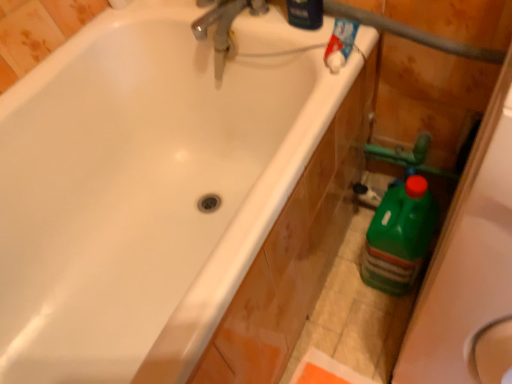
Question: Is green plastic bottle at right, which is counted as the first cleaning product, starting from the bottom, to the right of metallic chrome faucet at upper center from the viewer's perspective?

Choices:
 (A) yes
 (B) no

Answer: (A)

Question: Are green plastic bottle at right, which is counted as the first cleaning product, starting from the bottom, and metallic chrome faucet at upper center located far from each other?

Choices:
 (A) yes
 (B) no

Answer: (B)

Question: Is green plastic bottle at right, the 2th cleaning product viewed from the top, oriented towards metallic chrome faucet at upper center?

Choices:
 (A) no
 (B) yes

Answer: (A)

Question: From a real-world perspective, is green plastic bottle at right, which ranks as the 1th cleaning product in right-to-left order, positioned under metallic chrome faucet at upper center based on gravity?

Choices:
 (A) yes
 (B) no

Answer: (A)

Question: Is green plastic bottle at right, which ranks as the 1th cleaning product in right-to-left order, facing away from metallic chrome faucet at upper center?

Choices:
 (A) yes
 (B) no

Answer: (B)

Question: Can you confirm if green plastic bottle at right, the 2th cleaning product positioned from the front, is bigger than metallic chrome faucet at upper center?

Choices:
 (A) no
 (B) yes

Answer: (B)

Question: Does blue glossy bottle at upper right, placed as the 1th cleaning product when sorted from top to bottom, contain green plastic bottle at right, which ranks as the 1th cleaning product in right-to-left order?

Choices:
 (A) yes
 (B) no

Answer: (B)

Question: Is blue glossy bottle at upper right, placed as the second cleaning product when sorted from bottom to top, looking in the opposite direction of green plastic bottle at right, the 2th cleaning product viewed from the top?

Choices:
 (A) yes
 (B) no

Answer: (B)

Question: Are blue glossy bottle at upper right, placed as the 1th cleaning product when sorted from left to right, and green plastic bottle at right, which is counted as the first cleaning product, starting from the bottom, located far from each other?

Choices:
 (A) no
 (B) yes

Answer: (A)

Question: Is the position of blue glossy bottle at upper right, placed as the 1th cleaning product when sorted from top to bottom, more distant than that of green plastic bottle at right, which is counted as the first cleaning product, starting from the bottom?

Choices:
 (A) yes
 (B) no

Answer: (B)

Question: From the image's perspective, would you say blue glossy bottle at upper right, placed as the second cleaning product when sorted from bottom to top, is shown under green plastic bottle at right, which is counted as the first cleaning product, starting from the bottom?

Choices:
 (A) yes
 (B) no

Answer: (B)

Question: Considering the relative sizes of blue glossy bottle at upper right, placed as the 1th cleaning product when sorted from left to right, and green plastic bottle at right, which is counted as the first cleaning product, starting from the bottom, in the image provided, is blue glossy bottle at upper right, placed as the 1th cleaning product when sorted from left to right, shorter than green plastic bottle at right, which is counted as the first cleaning product, starting from the bottom,?

Choices:
 (A) no
 (B) yes

Answer: (B)

Question: From a real-world perspective, is metallic chrome faucet at upper center physically below green plastic bottle at right, the 2th cleaning product viewed from the top?

Choices:
 (A) no
 (B) yes

Answer: (A)